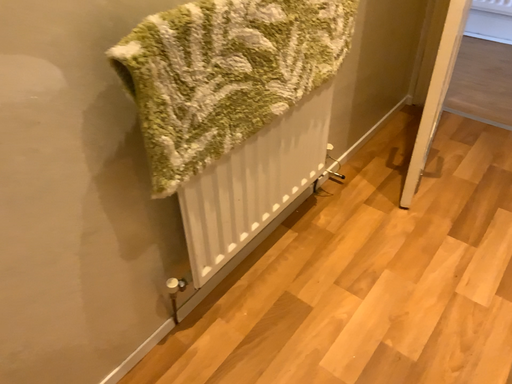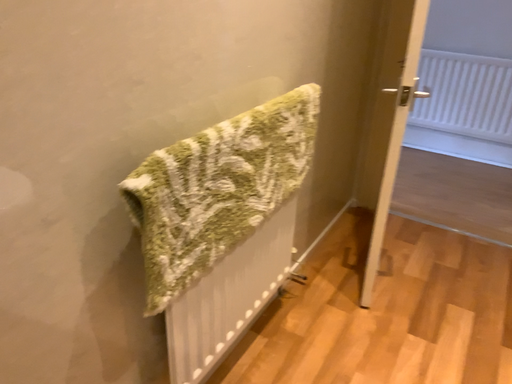
Question: How did the camera likely rotate when shooting the video?

Choices:
 (A) rotated left
 (B) rotated right

Answer: (B)